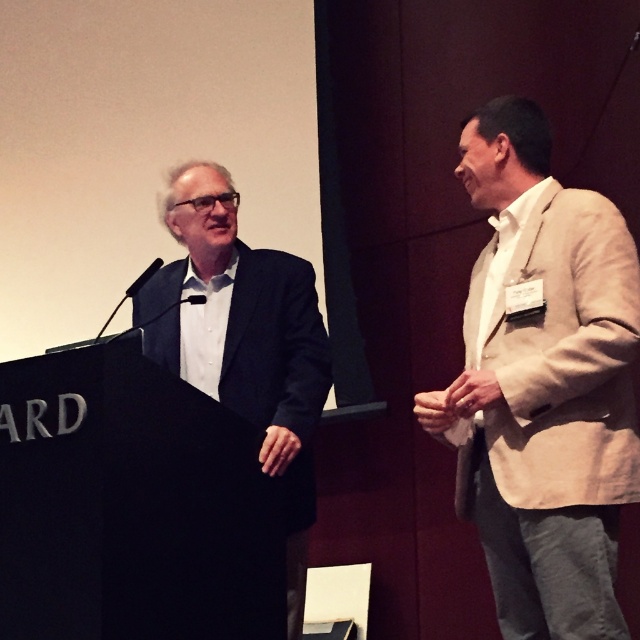
Question: Among these points, which one is nearest to the camera?

Choices:
 (A) (596, 314)
 (B) (280, 470)

Answer: (A)

Question: Which point is farther to the camera?

Choices:
 (A) dark blue suit at left
 (B) beige textured blazer at right

Answer: (A)

Question: Among these points, which one is farthest from the camera?

Choices:
 (A) (525, 132)
 (B) (198, 364)

Answer: (B)

Question: Observing the image, what is the correct spatial positioning of beige textured blazer at right in reference to dark blue suit at left?

Choices:
 (A) right
 (B) left

Answer: (A)

Question: Can you confirm if beige textured blazer at right is positioned to the right of dark blue suit at left?

Choices:
 (A) yes
 (B) no

Answer: (A)

Question: Does beige textured blazer at right appear under dark blue suit at left?

Choices:
 (A) no
 (B) yes

Answer: (A)